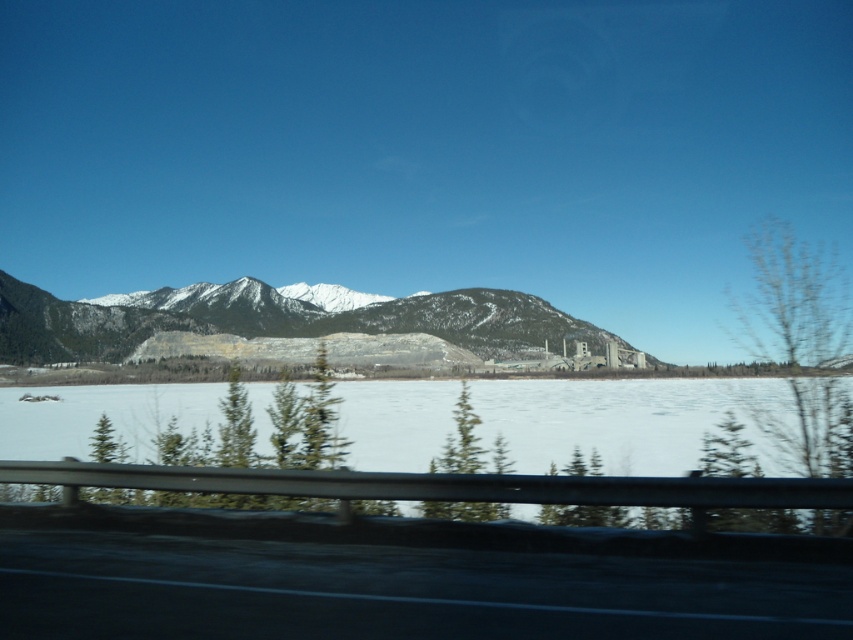
Question: Which object is farther from the camera taking this photo?

Choices:
 (A) black asphalt highway at lower center
 (B) snowy rock mountain at center
 (C) white ice at center

Answer: (B)

Question: Does white ice at center have a greater width compared to snowy rock mountain at center?

Choices:
 (A) yes
 (B) no

Answer: (B)

Question: Among these points, which one is nearest to the camera?

Choices:
 (A) (79, 346)
 (B) (634, 388)
 (C) (190, 593)

Answer: (C)

Question: Which object is closer to the camera taking this photo?

Choices:
 (A) snowy rock mountain at center
 (B) black asphalt highway at lower center
 (C) white ice at center

Answer: (B)

Question: Is white ice at center smaller than snowy rock mountain at center?

Choices:
 (A) no
 (B) yes

Answer: (B)

Question: Does black asphalt highway at lower center appear on the right side of snowy rock mountain at center?

Choices:
 (A) no
 (B) yes

Answer: (B)